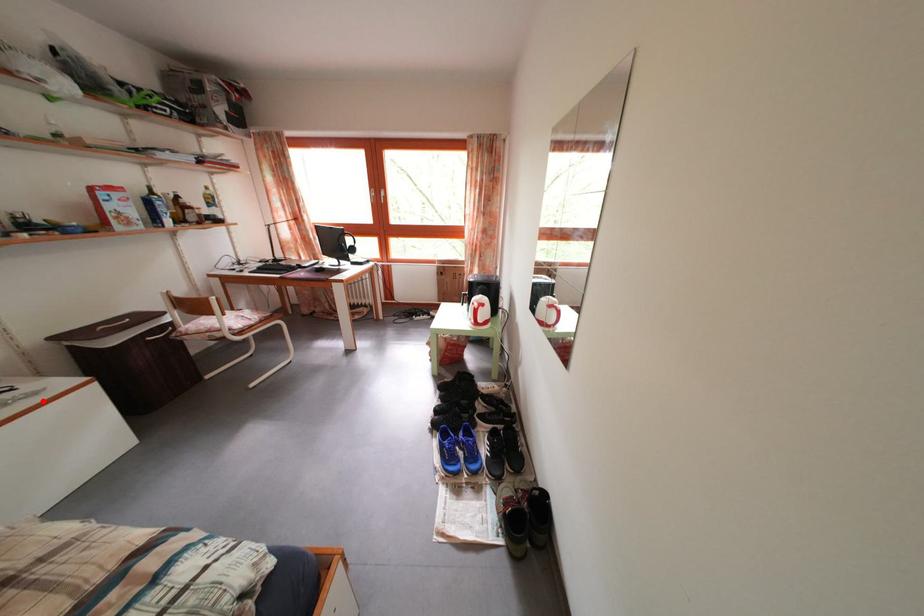
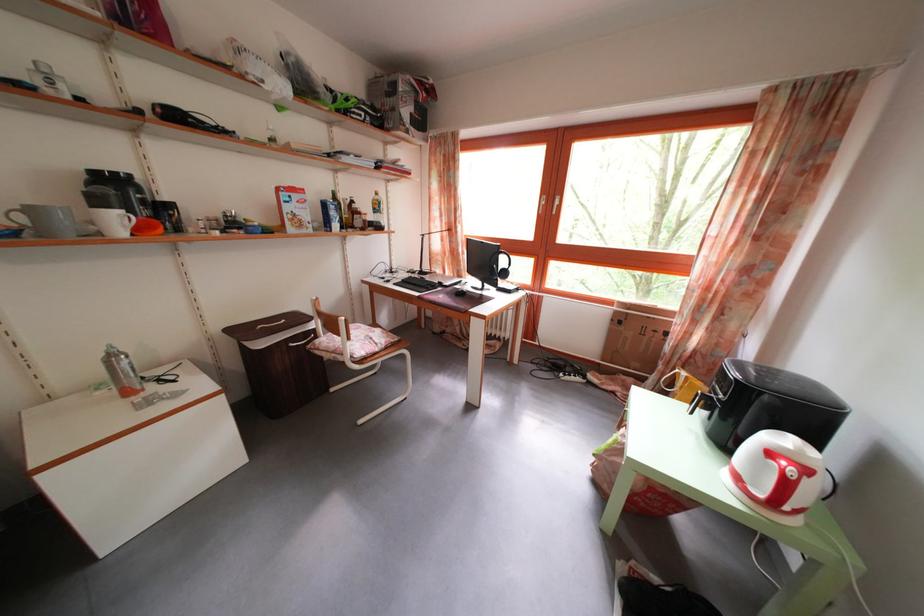
Question: I am providing you with two images of the same scene from different viewpoints. A red point is marked on the first image. Is the red point's position out of view in image 2?

Choices:
 (A) Yes
 (B) No

Answer: (B)